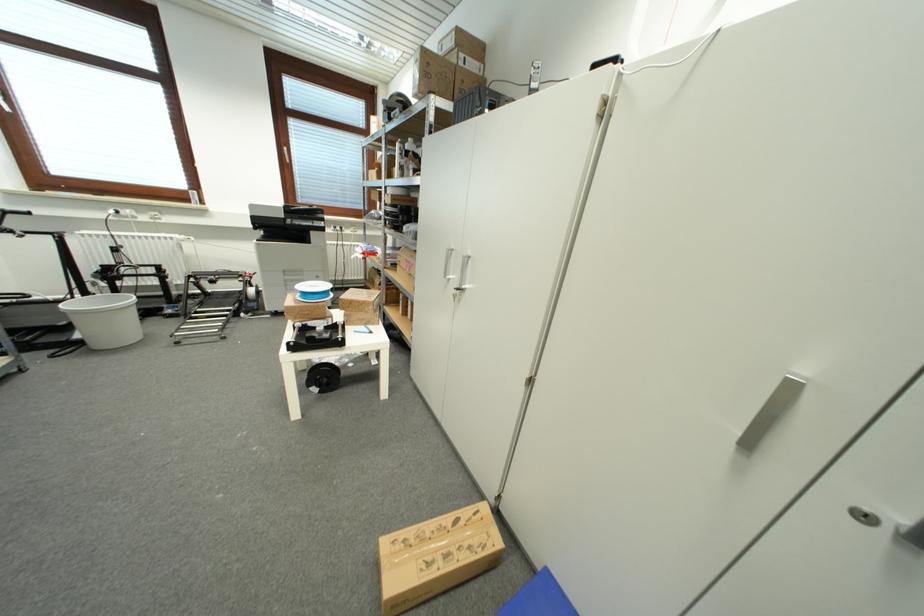
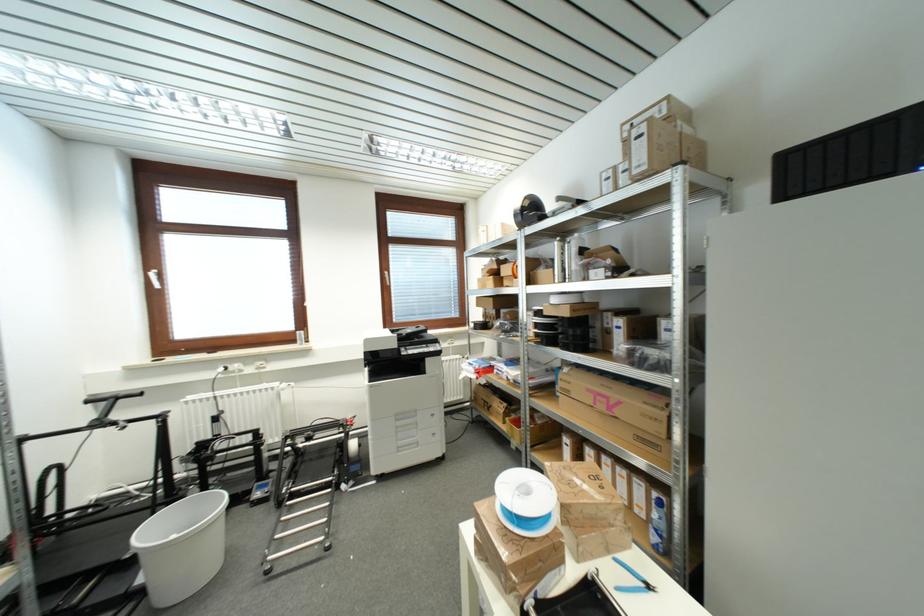
In the second image, find the point that corresponds to pixel 200 278 in the first image.

(297, 438)